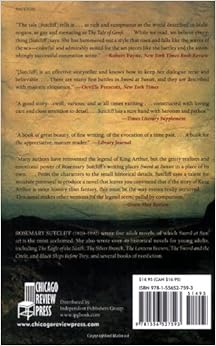
Where is `book`? The image size is (216, 346). book is located at coordinates (95, 245).